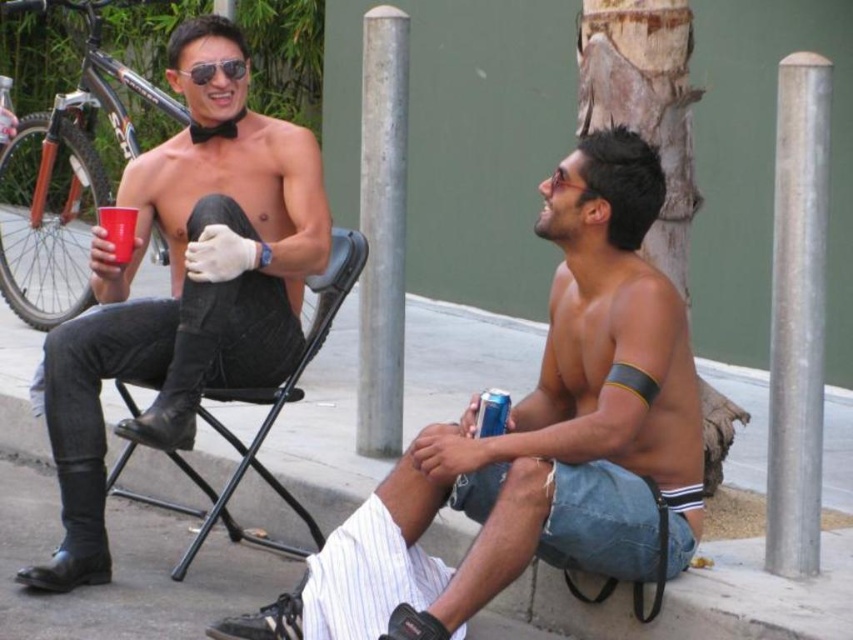
Question: Is shiny black leather boots at left behind silver metallic pole at center?

Choices:
 (A) yes
 (B) no

Answer: (B)

Question: Which object is farther from the camera taking this photo?

Choices:
 (A) black leather chair at center
 (B) silver metallic pole at center right
 (C) silver metallic pole at center
 (D) smooth skin torso at center

Answer: (C)

Question: Is red plastic cup at left below sunglasses at upper center?

Choices:
 (A) yes
 (B) no

Answer: (A)

Question: Considering the relative positions of black leather chair at center and blue plastic can at lower center in the image provided, where is black leather chair at center located with respect to blue plastic can at lower center?

Choices:
 (A) below
 (B) above

Answer: (A)

Question: Which is farther from the shiny black leather boots at left?

Choices:
 (A) black leather chair at center
 (B) blue plastic can at lower center

Answer: (B)

Question: Among these objects, which one is farthest from the camera?

Choices:
 (A) silver metallic pole at center right
 (B) black leather chair at center

Answer: (B)